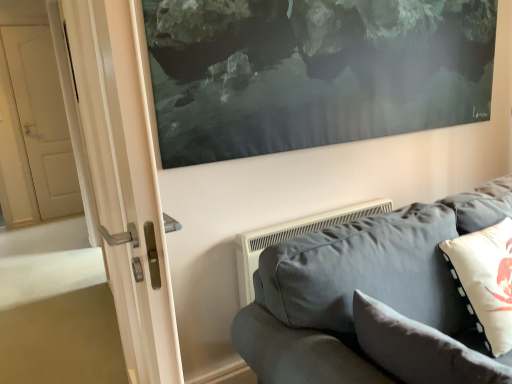
How much space does soft gray cushion at lower right, which is the first pillow from left to right, occupy horizontally?

The width of soft gray cushion at lower right, which is the first pillow from left to right, is 9.91 inches.

The width and height of the screenshot is (512, 384). Describe the element at coordinates (485, 281) in the screenshot. I see `white matte pillow at right, placed as the first pillow when sorted from right to left` at that location.

What do you see at coordinates (371, 300) in the screenshot?
I see `velvet gray couch at lower right` at bounding box center [371, 300].

Identify the location of soft gray cushion at lower right, which is the first pillow from left to right. The width and height of the screenshot is (512, 384). (421, 348).

Does white matte pillow at right, placed as the first pillow when sorted from right to left, touch velvet gray couch at lower right?

white matte pillow at right, placed as the first pillow when sorted from right to left, and velvet gray couch at lower right are clearly separated.

Can you confirm if white matte pillow at right, the second pillow from the left, is smaller than velvet gray couch at lower right?

Indeed, white matte pillow at right, the second pillow from the left, has a smaller size compared to velvet gray couch at lower right.

Can you confirm if white matte pillow at right, placed as the first pillow when sorted from right to left, is thinner than velvet gray couch at lower right?

Yes.

Which is correct: white matte pillow at right, placed as the first pillow when sorted from right to left, is inside velvet gray couch at lower right, or outside of it?

white matte pillow at right, placed as the first pillow when sorted from right to left, is located inside velvet gray couch at lower right.

Considering the positions of objects velvet gray couch at lower right and white matte pillow at right, placed as the first pillow when sorted from right to left, in the image provided, who is more to the left, velvet gray couch at lower right or white matte pillow at right, placed as the first pillow when sorted from right to left,?

From the viewer's perspective, velvet gray couch at lower right appears more on the left side.

Considering the sizes of velvet gray couch at lower right and white matte pillow at right, placed as the first pillow when sorted from right to left, in the image, is velvet gray couch at lower right wider or thinner than white matte pillow at right, placed as the first pillow when sorted from right to left,?

In the image, velvet gray couch at lower right appears to be wider than white matte pillow at right, placed as the first pillow when sorted from right to left.

Is velvet gray couch at lower right spatially inside white matte pillow at right, the second pillow from the left, or outside of it?

velvet gray couch at lower right is located beyond the bounds of white matte pillow at right, the second pillow from the left.

Consider the image. From a real-world perspective, is velvet gray couch at lower right under white matte pillow at right, placed as the first pillow when sorted from right to left?

Yes, from a real-world perspective, velvet gray couch at lower right is below white matte pillow at right, placed as the first pillow when sorted from right to left.

Does white matte pillow at right, placed as the first pillow when sorted from right to left, have a greater height compared to soft gray cushion at lower right, which is counted as the 2th pillow, starting from the right?

Yes, white matte pillow at right, placed as the first pillow when sorted from right to left, is taller than soft gray cushion at lower right, which is counted as the 2th pillow, starting from the right.

From a real-world perspective, is white matte pillow at right, placed as the first pillow when sorted from right to left, positioned above or below soft gray cushion at lower right, which is counted as the 2th pillow, starting from the right?

From a real-world perspective, white matte pillow at right, placed as the first pillow when sorted from right to left, is physically above soft gray cushion at lower right, which is counted as the 2th pillow, starting from the right.

Between white matte pillow at right, the second pillow from the left, and soft gray cushion at lower right, which is the first pillow from left to right, which one has larger width?

white matte pillow at right, the second pillow from the left, is wider.

From the image's perspective, is white matte pillow at right, the second pillow from the left, below soft gray cushion at lower right, which is counted as the 2th pillow, starting from the right?

Actually, white matte pillow at right, the second pillow from the left, appears above soft gray cushion at lower right, which is counted as the 2th pillow, starting from the right, in the image.

Can velvet gray couch at lower right be found inside soft gray cushion at lower right, which is the first pillow from left to right?

No, velvet gray couch at lower right is located outside of soft gray cushion at lower right, which is the first pillow from left to right.

Between soft gray cushion at lower right, which is counted as the 2th pillow, starting from the right, and velvet gray couch at lower right, which one is positioned behind?

soft gray cushion at lower right, which is counted as the 2th pillow, starting from the right, is more distant.

From the image's perspective, is soft gray cushion at lower right, which is counted as the 2th pillow, starting from the right, located above velvet gray couch at lower right?

Correct, soft gray cushion at lower right, which is counted as the 2th pillow, starting from the right, appears higher than velvet gray couch at lower right in the image.

How many degrees apart are the facing directions of velvet gray couch at lower right and soft gray cushion at lower right, which is the first pillow from left to right?

The facing directions of velvet gray couch at lower right and soft gray cushion at lower right, which is the first pillow from left to right, are 89.6 degrees apart.

Considering the sizes of objects velvet gray couch at lower right and soft gray cushion at lower right, which is counted as the 2th pillow, starting from the right, in the image provided, who is taller, velvet gray couch at lower right or soft gray cushion at lower right, which is counted as the 2th pillow, starting from the right,?

With more height is velvet gray couch at lower right.

Is velvet gray couch at lower right positioned far away from soft gray cushion at lower right, which is counted as the 2th pillow, starting from the right?

No, velvet gray couch at lower right is not far away from soft gray cushion at lower right, which is counted as the 2th pillow, starting from the right.

Does velvet gray couch at lower right come in front of soft gray cushion at lower right, which is the first pillow from left to right?

Yes, it is in front of soft gray cushion at lower right, which is the first pillow from left to right.

Is soft gray cushion at lower right, which is counted as the 2th pillow, starting from the right, next to white matte pillow at right, the second pillow from the left?

No, soft gray cushion at lower right, which is counted as the 2th pillow, starting from the right, is not beside white matte pillow at right, the second pillow from the left.

From a real-world perspective, which object rests below the other?

From a 3D spatial view, soft gray cushion at lower right, which is the first pillow from left to right, is below.

Does soft gray cushion at lower right, which is the first pillow from left to right, have a lesser width compared to white matte pillow at right, placed as the first pillow when sorted from right to left?

Yes.

Locate an element on the screen. This screenshot has width=512, height=384. pillow that is the 2nd object located behind the velvet gray couch at lower right is located at coordinates (485, 281).

Identify the location of studio couch on the left side of white matte pillow at right, placed as the first pillow when sorted from right to left. This screenshot has height=384, width=512. (371, 300).

Based on their spatial positions, is velvet gray couch at lower right or soft gray cushion at lower right, which is the first pillow from left to right, further from white matte pillow at right, placed as the first pillow when sorted from right to left?

The object further to white matte pillow at right, placed as the first pillow when sorted from right to left, is soft gray cushion at lower right, which is the first pillow from left to right.

Which object lies nearer to the anchor point velvet gray couch at lower right, soft gray cushion at lower right, which is counted as the 2th pillow, starting from the right, or white matte pillow at right, placed as the first pillow when sorted from right to left?

The object closer to velvet gray couch at lower right is soft gray cushion at lower right, which is counted as the 2th pillow, starting from the right.

Which object lies nearer to the anchor point white matte pillow at right, the second pillow from the left, soft gray cushion at lower right, which is counted as the 2th pillow, starting from the right, or velvet gray couch at lower right?

velvet gray couch at lower right.

Based on the photo, considering their positions, is white matte pillow at right, the second pillow from the left, positioned further to velvet gray couch at lower right than soft gray cushion at lower right, which is the first pillow from left to right?

white matte pillow at right, the second pillow from the left, is positioned further to the anchor velvet gray couch at lower right.

When comparing their distances from soft gray cushion at lower right, which is the first pillow from left to right, does white matte pillow at right, placed as the first pillow when sorted from right to left, or velvet gray couch at lower right seem closer?

velvet gray couch at lower right lies closer to soft gray cushion at lower right, which is the first pillow from left to right, than the other object.

Considering their positions, is velvet gray couch at lower right positioned closer to soft gray cushion at lower right, which is counted as the 2th pillow, starting from the right, than white matte pillow at right, placed as the first pillow when sorted from right to left?

velvet gray couch at lower right is closer to soft gray cushion at lower right, which is counted as the 2th pillow, starting from the right.

Where is `pillow between velvet gray couch at lower right and white matte pillow at right, the second pillow from the left, from front to back`? pillow between velvet gray couch at lower right and white matte pillow at right, the second pillow from the left, from front to back is located at coordinates pos(421,348).